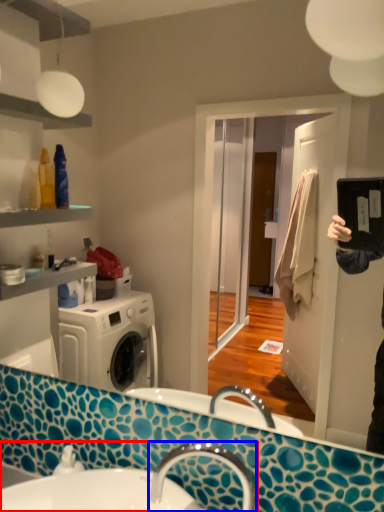
Question: Which object appears closest to the camera in this image, sink (highlighted by a red box) or tap (highlighted by a blue box)?

Choices:
 (A) sink
 (B) tap

Answer: (A)